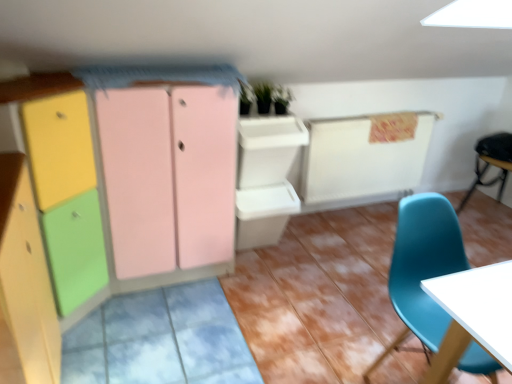
Question: Is matte pink cabinet at center, which is the 1th cabinetry from back to front, oriented away from black leather chair at right, positioned as the 1th chair in back-to-front order?

Choices:
 (A) no
 (B) yes

Answer: (A)

Question: From a real-world perspective, is matte pink cabinet at center, which is the third cabinetry from front to back, below black leather chair at right, the first chair in the right-to-left sequence?

Choices:
 (A) yes
 (B) no

Answer: (B)

Question: Does matte pink cabinet at center, which is the third cabinetry from front to back, have a lesser height compared to black leather chair at right, the first chair in the right-to-left sequence?

Choices:
 (A) no
 (B) yes

Answer: (A)

Question: Is matte pink cabinet at center, which is the 1th cabinetry from back to front, bigger than black leather chair at right, which is the first chair from top to bottom?

Choices:
 (A) yes
 (B) no

Answer: (A)

Question: Considering the relative sizes of matte pink cabinet at center, which is the 1th cabinetry from back to front, and black leather chair at right, which appears as the 2th chair when ordered from the bottom, in the image provided, is matte pink cabinet at center, which is the 1th cabinetry from back to front, smaller than black leather chair at right, which appears as the 2th chair when ordered from the bottom,?

Choices:
 (A) yes
 (B) no

Answer: (B)

Question: From the image's perspective, relative to matte wood cabinet at left, marked as the third cabinetry in a back-to-front arrangement, is green matte plant at upper center above or below?

Choices:
 (A) above
 (B) below

Answer: (A)

Question: Is green matte plant at upper center taller or shorter than matte wood cabinet at left, marked as the third cabinetry in a back-to-front arrangement?

Choices:
 (A) tall
 (B) short

Answer: (B)

Question: Which is correct: green matte plant at upper center is inside matte wood cabinet at left, marked as the third cabinetry in a back-to-front arrangement, or outside of it?

Choices:
 (A) outside
 (B) inside

Answer: (A)

Question: Is green matte plant at upper center wider or thinner than matte wood cabinet at left, marked as the third cabinetry in a back-to-front arrangement?

Choices:
 (A) wide
 (B) thin

Answer: (B)

Question: Is teal plastic chair at lower right, which ranks as the 2th chair in right-to-left order, in front of or behind green matte plant at upper center in the image?

Choices:
 (A) front
 (B) behind

Answer: (A)

Question: Considering the positions of teal plastic chair at lower right, marked as the 2th chair in a top-to-bottom arrangement, and green matte plant at upper center in the image, is teal plastic chair at lower right, marked as the 2th chair in a top-to-bottom arrangement, taller or shorter than green matte plant at upper center?

Choices:
 (A) tall
 (B) short

Answer: (A)

Question: From a real-world perspective, relative to green matte plant at upper center, is teal plastic chair at lower right, marked as the 2th chair in a top-to-bottom arrangement, vertically above or below?

Choices:
 (A) below
 (B) above

Answer: (A)

Question: From the image's perspective, relative to green matte plant at upper center, is teal plastic chair at lower right, which ranks as the 2th chair in back-to-front order, above or below?

Choices:
 (A) above
 (B) below

Answer: (B)

Question: Is point (41, 266) positioned closer to the camera than point (67, 152)?

Choices:
 (A) farther
 (B) closer

Answer: (B)

Question: From their relative heights in the image, would you say matte wood cabinet at left, marked as the third cabinetry in a back-to-front arrangement, is taller or shorter than matte wood cabinet at left, placed as the second cabinetry when sorted from front to back?

Choices:
 (A) tall
 (B) short

Answer: (B)